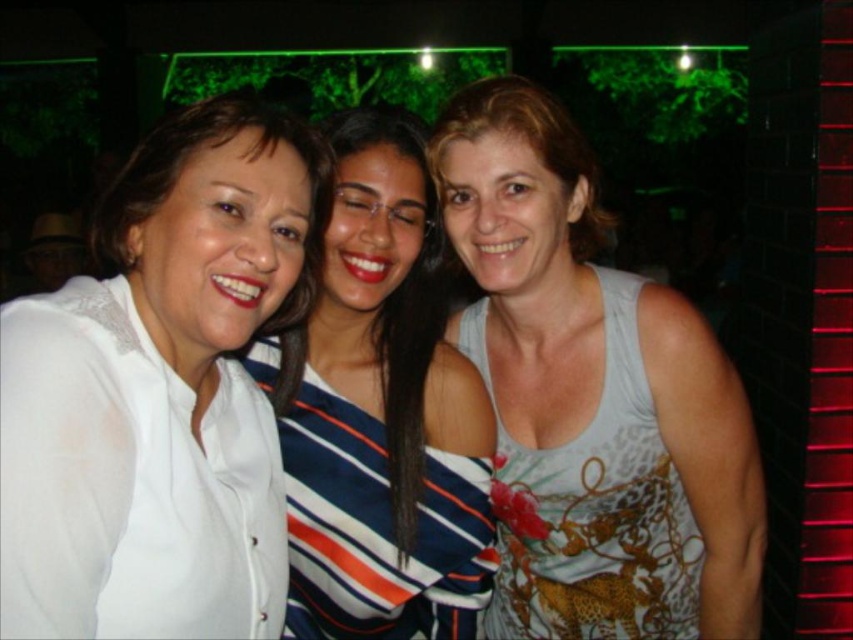
You are standing at the point with coordinates (384, 419) in the image. Which object from the scene are you currently standing on?

You are standing on the white matte shirt at center.

You are a photographer trying to adjust the lighting for a group photo. You notice the white sheer blouse at left and the white printed tank top at right. Which clothing item requires more downward adjustment to ensure proper exposure, considering their sizes?

The white sheer blouse at left has a lesser height compared to the white printed tank top at right, so it requires more downward adjustment to ensure proper exposure.